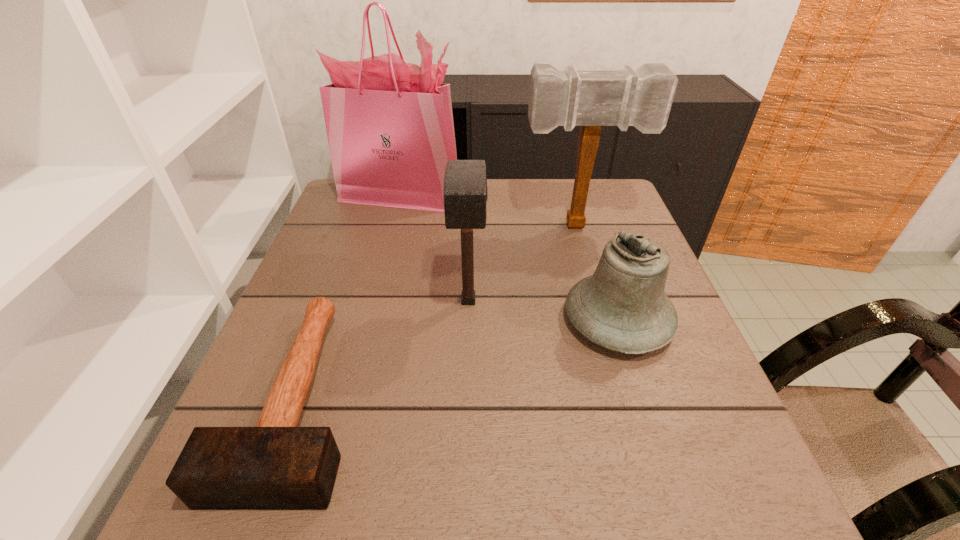
The width and height of the screenshot is (960, 540). What are the coordinates of `vacant space located 0.260m on the left of the second tallest object` in the screenshot? It's located at (423, 226).

At what (x,y) coordinates should I click in order to perform the action: click on blank area located 0.130m on the front of the second tallest mallet. Please return your answer as a coordinate pair (x, y). Looking at the image, I should click on (467, 374).

This screenshot has width=960, height=540. Find the location of `free space located on the left of the bell`. free space located on the left of the bell is located at coordinates (521, 320).

This screenshot has height=540, width=960. Find the location of `shopping bag that is positioned at the far edge`. shopping bag that is positioned at the far edge is located at coordinates (390, 129).

Locate an element on the screen. Image resolution: width=960 pixels, height=540 pixels. mallet situated at the far edge is located at coordinates point(642,98).

I want to click on object at the near edge, so click(275, 465).

Find the location of `shopping bag that is at the left edge`. shopping bag that is at the left edge is located at coordinates (390, 129).

Where is `mallet that is at the left edge`? mallet that is at the left edge is located at coordinates (275, 465).

Find the location of a particular element. mallet present at the right edge is located at coordinates (642, 98).

At what (x,y) coordinates should I click in order to perform the action: click on bell located in the right edge section of the desktop. Please return your answer as a coordinate pair (x, y). This screenshot has width=960, height=540. Looking at the image, I should click on (622, 307).